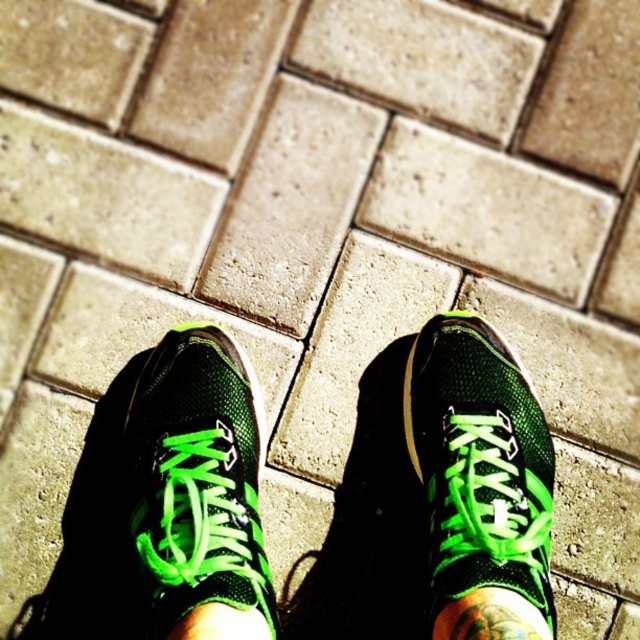
Question: Observing the image, what is the correct spatial positioning of green mesh shoe at center in reference to green mesh sock at center?

Choices:
 (A) left
 (B) right

Answer: (B)

Question: Is green mesh shoe at center wider than green mesh sock at center?

Choices:
 (A) yes
 (B) no

Answer: (A)

Question: Which object appears closest to the camera in this image?

Choices:
 (A) green mesh sock at center
 (B) green mesh shoe at center

Answer: (B)

Question: Considering the relative positions of green mesh shoe at center and green mesh sock at center in the image provided, where is green mesh shoe at center located with respect to green mesh sock at center?

Choices:
 (A) below
 (B) above

Answer: (B)